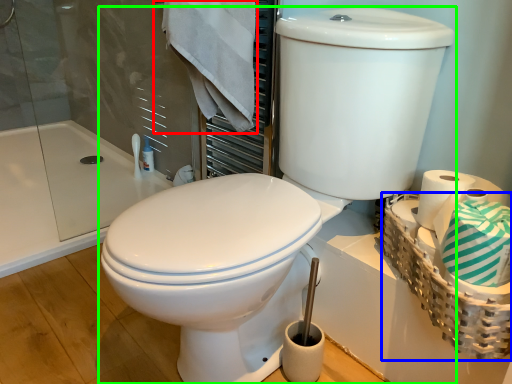
Question: Which object is positioned closest to bath towel (highlighted by a red box)? Select from basket (highlighted by a blue box) and toilet (highlighted by a green box).

Choices:
 (A) basket
 (B) toilet

Answer: (B)